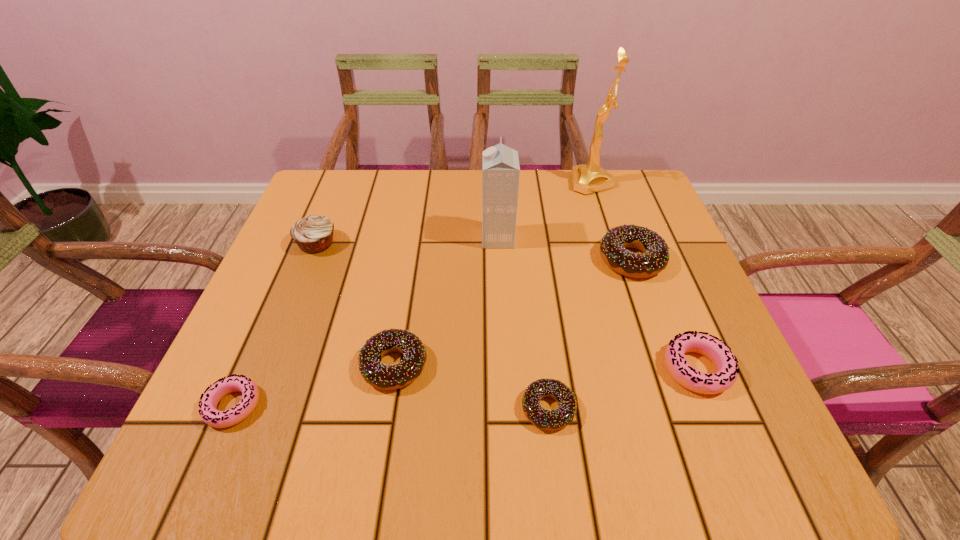
Locate an element on the screen. the tallest object is located at coordinates (589, 178).

Identify the location of the farthest object. (589, 178).

Find the location of a particular element. The height and width of the screenshot is (540, 960). carton is located at coordinates (500, 164).

Locate an element on the screen. The width and height of the screenshot is (960, 540). the third tallest object is located at coordinates (313, 234).

The width and height of the screenshot is (960, 540). What are the coordinates of `the biggest chocolate doughnut` in the screenshot? It's located at (655, 257).

You are a GUI agent. You are given a task and a screenshot of the screen. Output one action in this format:
    pyautogui.click(x=<x>, y=<y>)
    Task: Click on the fourth tallest object
    The image size is (960, 540).
    Given the screenshot: What is the action you would take?
    pyautogui.click(x=655, y=257)

The height and width of the screenshot is (540, 960). I want to click on the second smallest chocolate doughnut, so click(x=387, y=377).

Image resolution: width=960 pixels, height=540 pixels. In order to click on the leftmost chocolate doughnut in this screenshot , I will do `click(387, 377)`.

The height and width of the screenshot is (540, 960). I want to click on the right pink doughnut, so click(720, 354).

I want to click on the second chocolate doughnut from right to left, so click(563, 415).